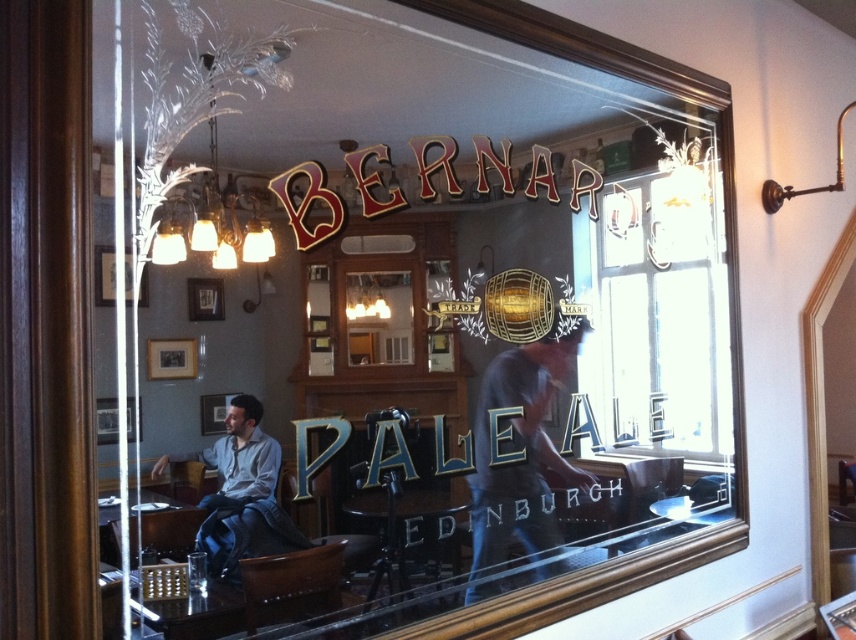
You are a customer entering the pub and looking around. You notice a transparent glass window at center and dark blue jeans at center. Which object takes up more space in the scene?

The transparent glass window at center is bigger than dark blue jeans at center, so the transparent glass window at center takes up more space in the scene.

You are a customer standing in the pub and want to look outside through the transparent glass window at center. However, you are wearing the dark blue jeans at center. Can you see outside through the window without bending down?

The transparent glass window at center is much taller than the dark blue jeans at center, so you can see outside without bending down because the window is higher up than your jeans.

You are a customer sitting at a table in the pub. You notice both the transparent glass window at center and the dark blue jeans at center. Which object is closer to you?

The transparent glass window at center is closer to you than the dark blue jeans at center.